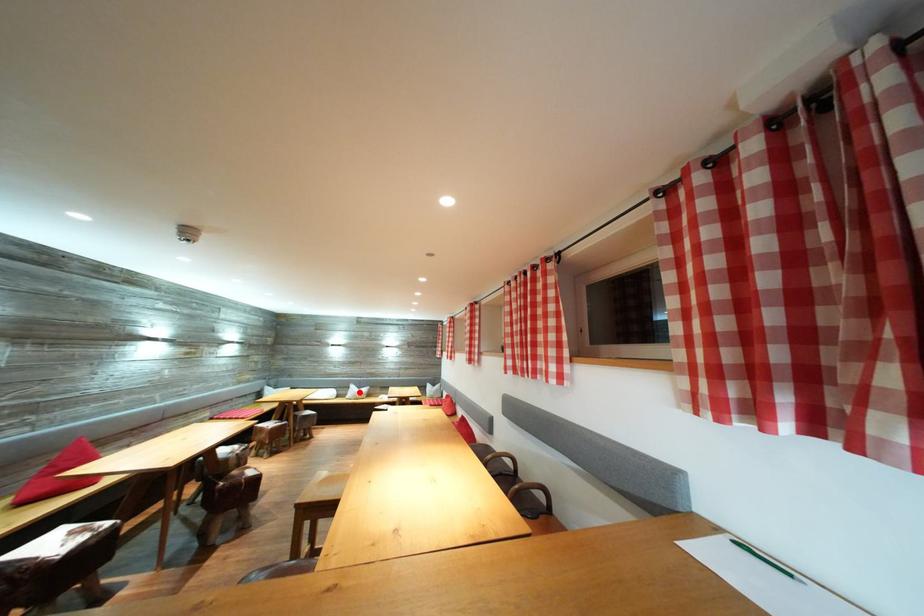
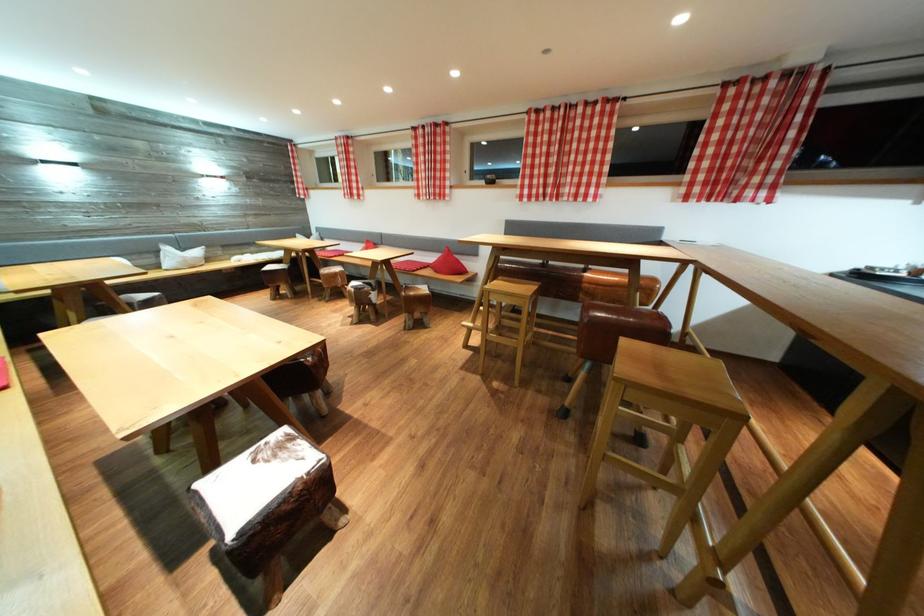
Question: I am providing you with two images of the same scene from different viewpoints. A red point is shown in image1. For the corresponding object point in image2, is it positioned nearer or farther from the camera?

Choices:
 (A) Nearer
 (B) Farther

Answer: (A)